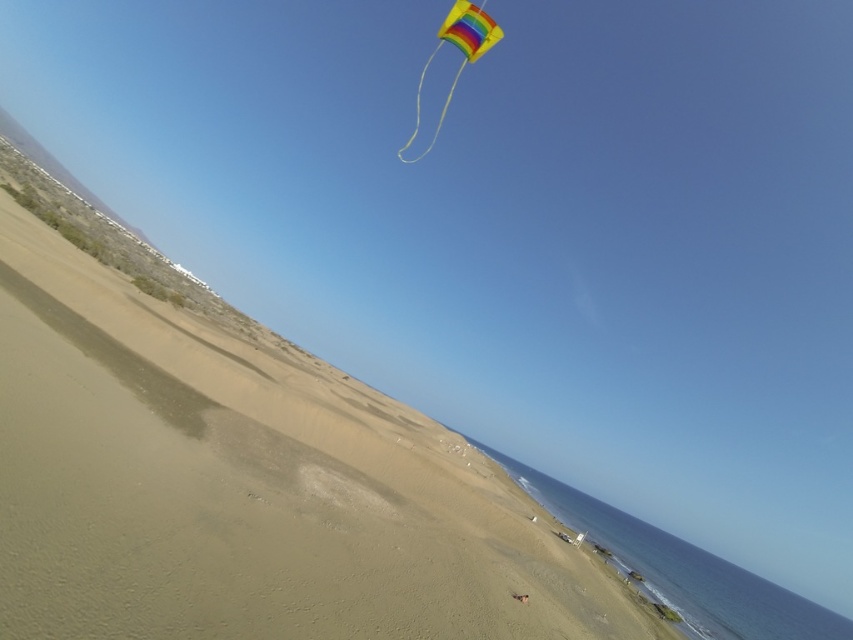
Who is taller, smooth sand at center or rainbow fabric kite at upper center?

rainbow fabric kite at upper center

Consider the image. Is smooth sand at center above rainbow fabric kite at upper center?

Incorrect, smooth sand at center is not positioned above rainbow fabric kite at upper center.

Which is behind, point (74, 602) or point (461, 40)?

The point (461, 40) is behind.

I want to click on smooth sand at center, so click(x=245, y=486).